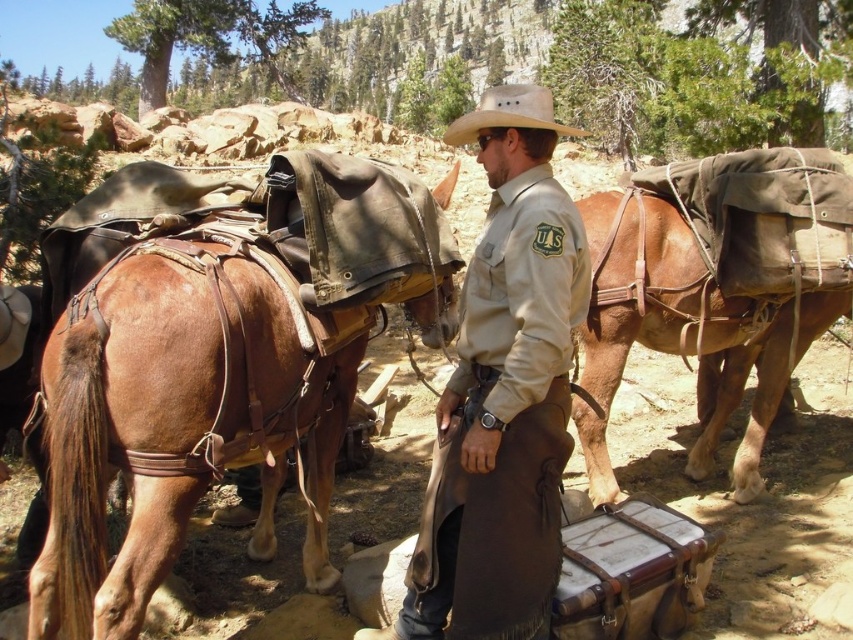
What do you see at coordinates (178, 420) in the screenshot?
I see `brown leather saddle at left` at bounding box center [178, 420].

Who is shorter, brown leather saddle at left or tan leather cowboy hat at center?

brown leather saddle at left

The image size is (853, 640). What do you see at coordinates (178, 420) in the screenshot?
I see `brown leather saddle at left` at bounding box center [178, 420].

In order to click on brown leather saddle at left in this screenshot , I will do `click(178, 420)`.

Does brown leather saddle at left have a lesser height compared to brown leather saddle at center?

Correct, brown leather saddle at left is not as tall as brown leather saddle at center.

The height and width of the screenshot is (640, 853). Describe the element at coordinates (178, 420) in the screenshot. I see `brown leather saddle at left` at that location.

Identify the location of brown leather saddle at left. (178, 420).

Between brown leather saddle at center and tan leather cowboy hat at center, which one has more height?

tan leather cowboy hat at center is taller.

Who is more forward, (x=699, y=312) or (x=479, y=122)?

Point (x=479, y=122)

Identify the location of brown leather saddle at center. pyautogui.click(x=682, y=332).

The width and height of the screenshot is (853, 640). I want to click on brown leather saddle at center, so click(x=682, y=332).